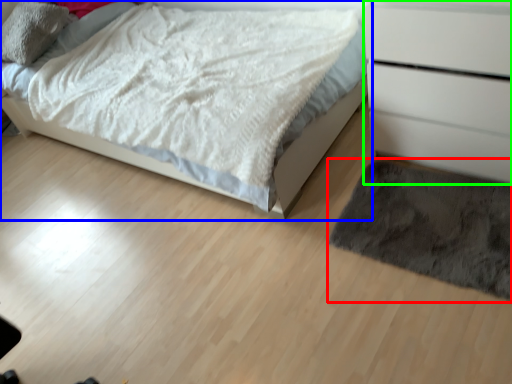
Question: Based on their relative distances, which object is farther from mat (highlighted by a red box)? Choose from bed (highlighted by a blue box) and chest of drawers (highlighted by a green box).

Choices:
 (A) bed
 (B) chest of drawers

Answer: (A)